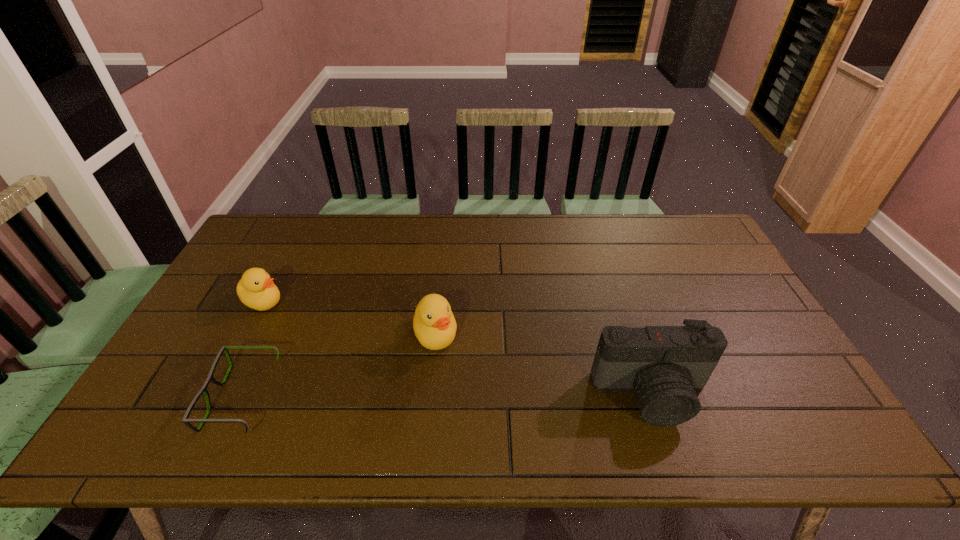
Locate an element on the screen. the shortest object is located at coordinates (185, 420).

Where is `camera`? This screenshot has height=540, width=960. camera is located at coordinates [x=665, y=365].

Identify the location of the tallest object. The image size is (960, 540). pos(665,365).

Locate an element on the screen. The width and height of the screenshot is (960, 540). the second object from right to left is located at coordinates tap(434, 324).

This screenshot has height=540, width=960. Identify the location of the second tallest object. (434, 324).

Identify the location of the second shortest object. (256, 289).

The width and height of the screenshot is (960, 540). What are the coordinates of `blank area located on the lens of the shortest object` in the screenshot? It's located at (162, 397).

The image size is (960, 540). In order to click on vacant area located 0.100m on the lens of the shortest object in this screenshot , I will do point(175,397).

Find the location of a particular element. free space located at the beak of the second object from right to left is located at coordinates (449, 401).

Where is `vacant space located 0.140m at the beak of the second object from right to left`? The height and width of the screenshot is (540, 960). vacant space located 0.140m at the beak of the second object from right to left is located at coordinates (449, 401).